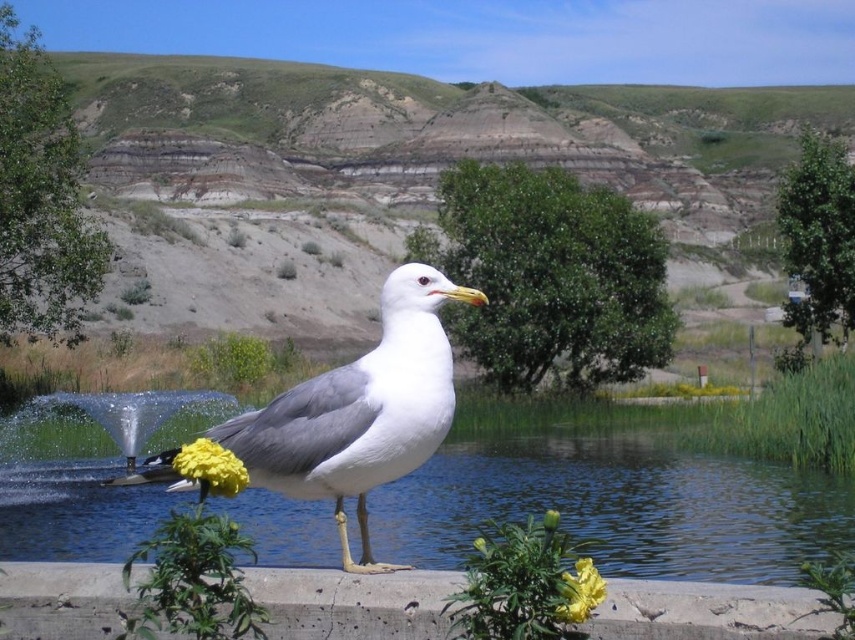
You are standing at the edge of the concrete ledge where the seagull is perched. You want to throw a pebble into the clear blue water at center. Based on the coordinates provided in the description, in which direction should you aim relative to the seagull?

The clear blue water at center is located at point coordinates, so you should aim towards the center of the image where the water is positioned.

You are a photographer trying to capture the yellow matte flower at center and the clear blue water at center in a single shot. Based on the scene, which object will appear closer to the camera in the photo?

The clear blue water at center will appear closer to the camera because the yellow matte flower at center is behind it.

You are a photographer trying to capture the white matte seagull at center and the clear blue water at center in a single shot. Based on their positions, which one would appear closer to the camera in the photo?

The white matte seagull at center appears closer to the camera because it is positioned in front of the clear blue water at center, which is further away.